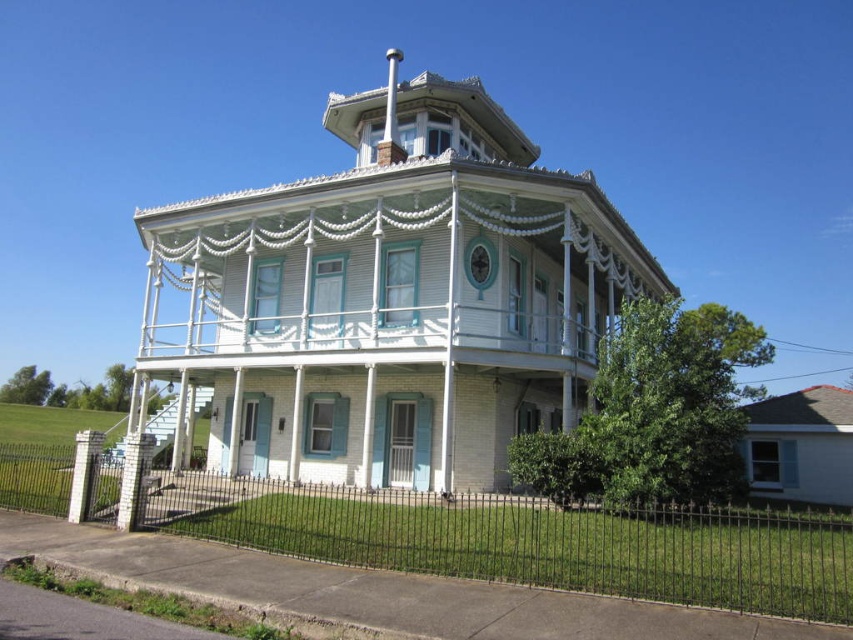
You are a visitor approaching the house and want to enter through the front door. Which object must you pass first between the black wrought iron fence at lower center and the white wood porch at center?

The black wrought iron fence at lower center must be passed first since it is positioned on the right side of the white wood porch at center, meaning it is closer to the entrance path.